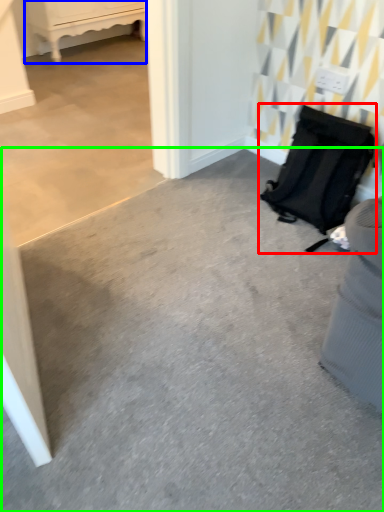
Question: Estimate the real-world distances between objects in this image. Which object is farther from luggage and bags (highlighted by a red box), furniture (highlighted by a blue box) or concrete (highlighted by a green box)?

Choices:
 (A) furniture
 (B) concrete

Answer: (A)